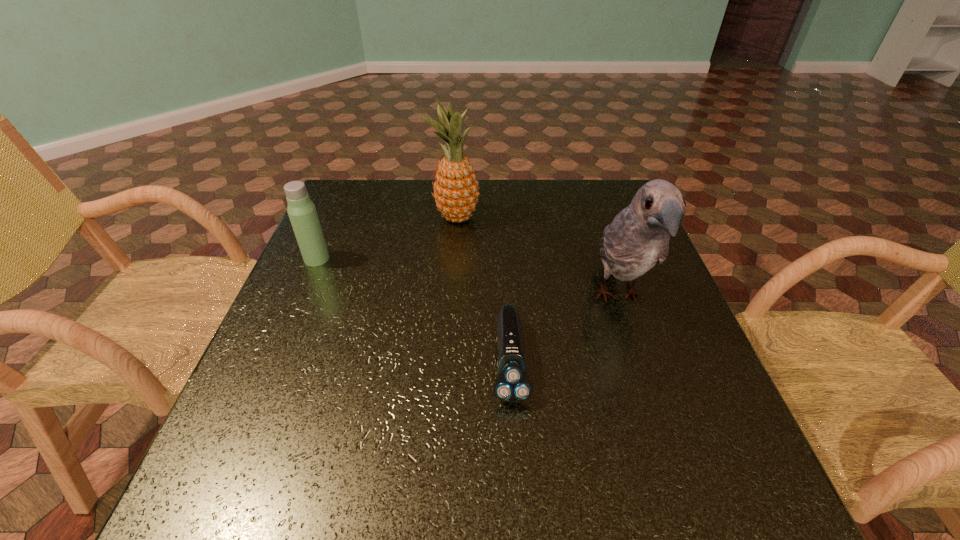
Where is `pineapple`? This screenshot has width=960, height=540. pineapple is located at coordinates (456, 194).

Locate an element on the screen. Image resolution: width=960 pixels, height=540 pixels. the third object from right to left is located at coordinates (456, 194).

Where is `the rightmost object`? the rightmost object is located at coordinates (638, 238).

The width and height of the screenshot is (960, 540). What are the coordinates of `the leftmost object` in the screenshot? It's located at (302, 213).

Find the location of a particular element. The image size is (960, 540). the second shortest object is located at coordinates [x=302, y=213].

The image size is (960, 540). In order to click on electric shaver in this screenshot , I will do `click(512, 384)`.

Where is `the shortest object`? the shortest object is located at coordinates (512, 384).

The image size is (960, 540). Find the location of `vacant space situated on the front of the pineapple`. vacant space situated on the front of the pineapple is located at coordinates (448, 327).

I want to click on free spot located on the front-facing side of the parrot, so click(681, 484).

This screenshot has height=540, width=960. Find the location of `vacant region located on the front of the leftmost object`. vacant region located on the front of the leftmost object is located at coordinates (307, 280).